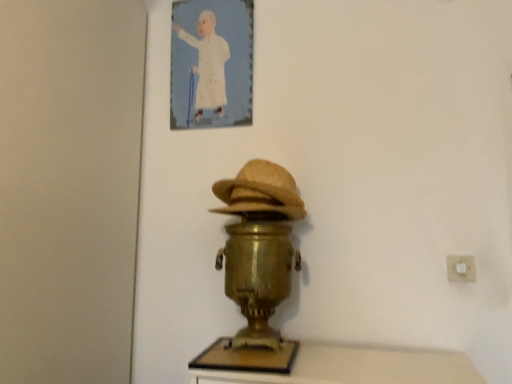
Question: From a real-world perspective, does gold metallic samovar at center sit lower than bleached straw hat at center?

Choices:
 (A) yes
 (B) no

Answer: (A)

Question: Considering the relative sizes of gold metallic samovar at center and bleached straw hat at center in the image provided, is gold metallic samovar at center smaller than bleached straw hat at center?

Choices:
 (A) yes
 (B) no

Answer: (B)

Question: Can you confirm if gold metallic samovar at center is thinner than bleached straw hat at center?

Choices:
 (A) no
 (B) yes

Answer: (A)

Question: Is gold metallic samovar at center positioned far away from bleached straw hat at center?

Choices:
 (A) yes
 (B) no

Answer: (B)

Question: Would you say gold metallic samovar at center contains bleached straw hat at center?

Choices:
 (A) yes
 (B) no

Answer: (A)

Question: Is the depth of gold metallic samovar at center greater than that of bleached straw hat at center?

Choices:
 (A) no
 (B) yes

Answer: (A)

Question: Is white paper at upper center positioned before bleached straw hat at center?

Choices:
 (A) no
 (B) yes

Answer: (A)

Question: Does white paper at upper center have a lesser height compared to bleached straw hat at center?

Choices:
 (A) no
 (B) yes

Answer: (A)

Question: From the image's perspective, would you say white paper at upper center is positioned over bleached straw hat at center?

Choices:
 (A) yes
 (B) no

Answer: (A)

Question: Considering the relative sizes of white paper at upper center and bleached straw hat at center in the image provided, is white paper at upper center taller than bleached straw hat at center?

Choices:
 (A) yes
 (B) no

Answer: (A)

Question: From a real-world perspective, is white paper at upper center on top of bleached straw hat at center?

Choices:
 (A) no
 (B) yes

Answer: (B)

Question: Is white paper at upper center wider than bleached straw hat at center?

Choices:
 (A) yes
 (B) no

Answer: (B)

Question: Considering the relative sizes of white plastic electric outlet at lower right and gold metallic samovar at center in the image provided, is white plastic electric outlet at lower right shorter than gold metallic samovar at center?

Choices:
 (A) yes
 (B) no

Answer: (A)